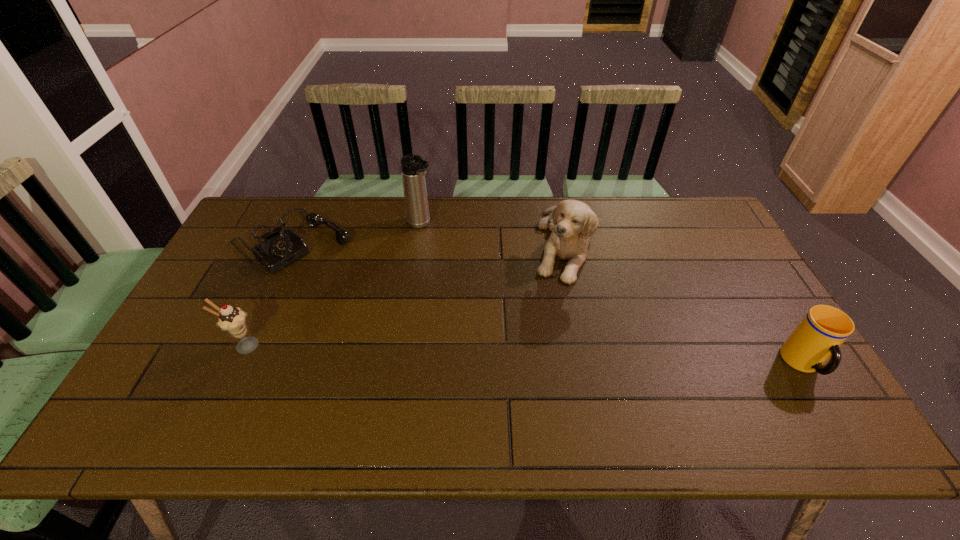
This screenshot has width=960, height=540. Find the location of `vacant space at the far left corner`. vacant space at the far left corner is located at coordinates pos(243,239).

Find the location of a particular element. The height and width of the screenshot is (540, 960). vacant point located between the tallest object and the rightmost object is located at coordinates (612, 295).

The height and width of the screenshot is (540, 960). In order to click on free area in between the second object from right to left and the cup in this screenshot , I will do `click(684, 304)`.

This screenshot has width=960, height=540. What are the coordinates of `empty space between the rightmost object and the fourth object from left to right` in the screenshot? It's located at (684, 304).

What are the coordinates of `free space between the shortest object and the tallest object` in the screenshot? It's located at (357, 233).

Find the location of a particular element. The image size is (960, 540). unoccupied position between the cup and the telephone is located at coordinates (548, 302).

This screenshot has width=960, height=540. Find the location of `vacant area that lies between the third object from left to right and the cup`. vacant area that lies between the third object from left to right and the cup is located at coordinates (612, 295).

Image resolution: width=960 pixels, height=540 pixels. I want to click on free space between the second shortest object and the tallest object, so click(x=612, y=295).

The image size is (960, 540). Find the location of `free space between the puppy and the telephone`. free space between the puppy and the telephone is located at coordinates (429, 242).

Locate an element on the screen. The height and width of the screenshot is (540, 960). free space between the fourth object from left to right and the icecream is located at coordinates (404, 295).